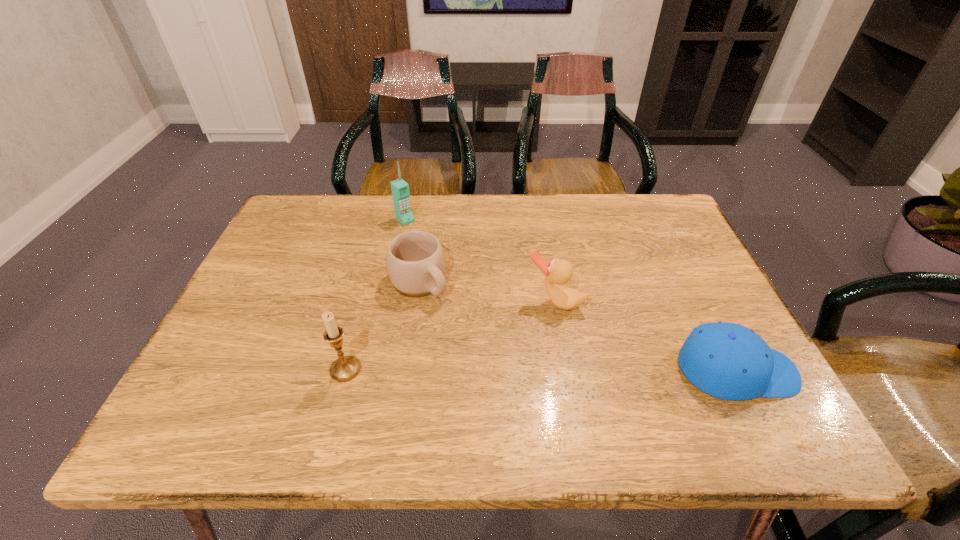
The width and height of the screenshot is (960, 540). What are the coordinates of `free space on the desktop that is between the candle holder and the cap and is positioned on the beak of the second object from right to left` in the screenshot? It's located at (523, 370).

Find the location of a particular element. The height and width of the screenshot is (540, 960). free space on the desktop that is between the candle holder and the cap and is positioned on the keypad of the cellular telephone is located at coordinates click(x=564, y=370).

Identify the location of vacant space on the desktop that is between the candle holder and the cap and is positioned on the side of the mug with the handle. The image size is (960, 540). (516, 370).